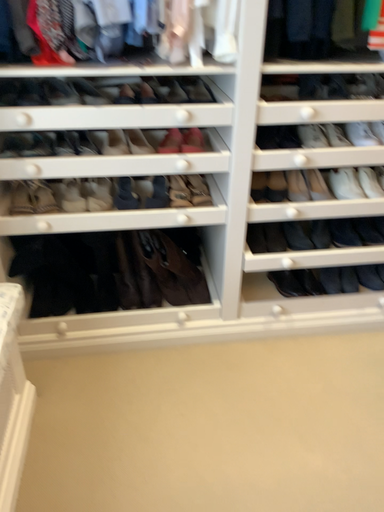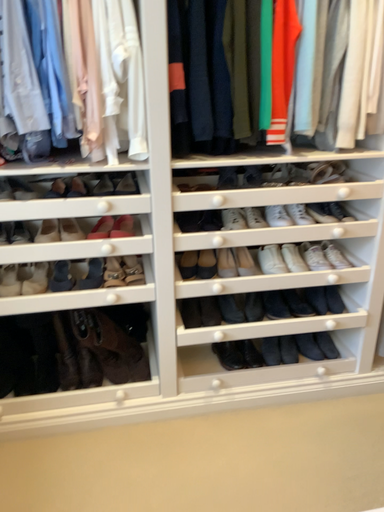
Question: Which way did the camera rotate in the video?

Choices:
 (A) rotated downward
 (B) rotated upward

Answer: (B)